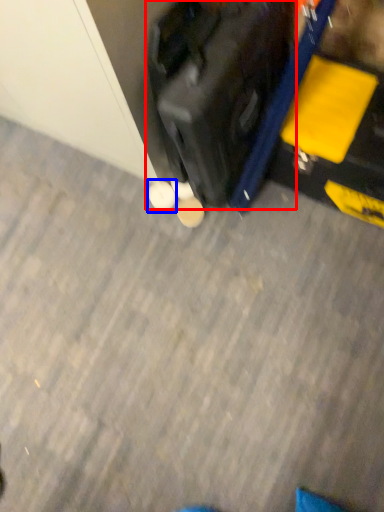
Question: Which object appears farthest to the camera in this image, suitcase (highlighted by a red box) or footwear (highlighted by a blue box)?

Choices:
 (A) suitcase
 (B) footwear

Answer: (B)